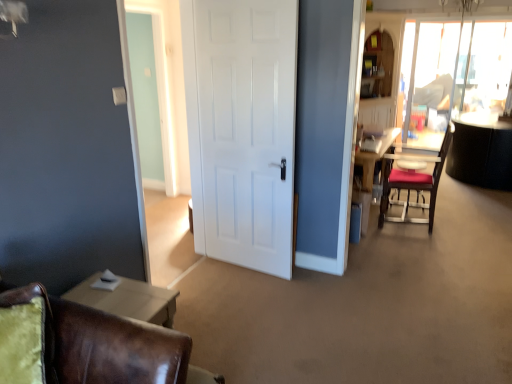
Question: From a real-world perspective, is white matte door at center on top of velvet red chair at right, which is counted as the 2th chair, starting from the bottom?

Choices:
 (A) yes
 (B) no

Answer: (A)

Question: Is white matte door at center wider than velvet red chair at right, which is counted as the 2th chair, starting from the bottom?

Choices:
 (A) no
 (B) yes

Answer: (A)

Question: Is velvet red chair at right, positioned as the second chair in front-to-back order, inside white matte door at center?

Choices:
 (A) no
 (B) yes

Answer: (A)

Question: Considering the relative sizes of white matte door at center and velvet red chair at right, acting as the second chair starting from the left, in the image provided, is white matte door at center taller than velvet red chair at right, acting as the second chair starting from the left,?

Choices:
 (A) yes
 (B) no

Answer: (A)

Question: Does white matte door at center turn towards velvet red chair at right, positioned as the second chair in front-to-back order?

Choices:
 (A) no
 (B) yes

Answer: (A)

Question: In terms of width, does white matte door at center look wider or thinner when compared to transparent glass window screen at upper right?

Choices:
 (A) thin
 (B) wide

Answer: (A)

Question: Is white matte door at center bigger or smaller than transparent glass window screen at upper right?

Choices:
 (A) small
 (B) big

Answer: (A)

Question: Does point (202, 228) appear closer or farther from the camera than point (437, 137)?

Choices:
 (A) closer
 (B) farther

Answer: (A)

Question: In the image, is white matte door at center positioned in front of or behind transparent glass window screen at upper right?

Choices:
 (A) front
 (B) behind

Answer: (A)

Question: Is velvet red chair at right, positioned as the first chair in top-to-bottom order, inside or outside of transparent glass window screen at upper right?

Choices:
 (A) inside
 (B) outside

Answer: (B)

Question: Is velvet red chair at right, the first chair when ordered from right to left, in front of or behind transparent glass window screen at upper right in the image?

Choices:
 (A) front
 (B) behind

Answer: (A)

Question: From their relative heights in the image, would you say velvet red chair at right, acting as the second chair starting from the left, is taller or shorter than transparent glass window screen at upper right?

Choices:
 (A) tall
 (B) short

Answer: (B)

Question: From the image's perspective, is velvet red chair at right, positioned as the second chair in front-to-back order, above or below transparent glass window screen at upper right?

Choices:
 (A) above
 (B) below

Answer: (B)

Question: Considering the relative positions of white matte door at center and brown leather chair at lower left, the 1th chair viewed from the left, in the image provided, is white matte door at center to the left or to the right of brown leather chair at lower left, the 1th chair viewed from the left,?

Choices:
 (A) right
 (B) left

Answer: (A)

Question: Does point (254, 137) appear closer or farther from the camera than point (121, 344)?

Choices:
 (A) closer
 (B) farther

Answer: (B)